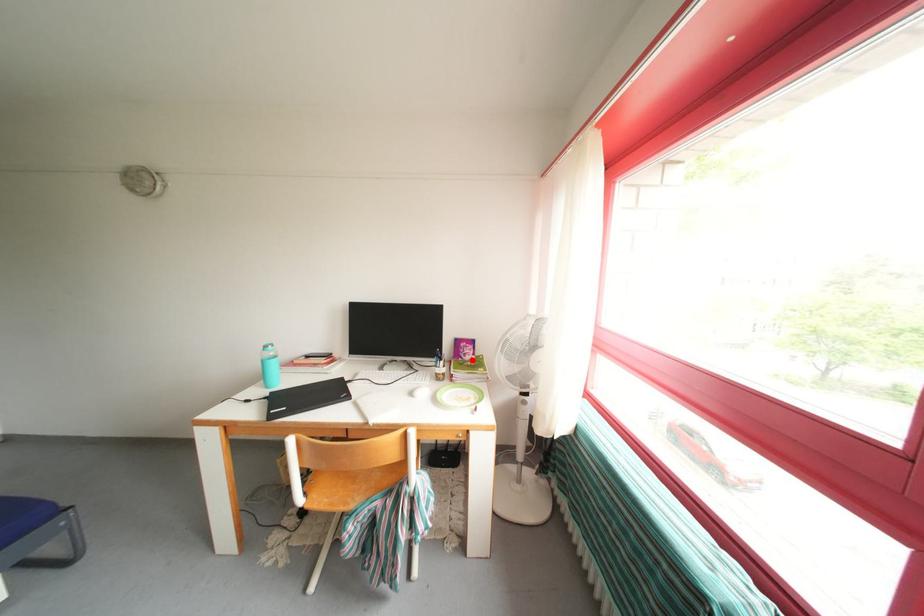
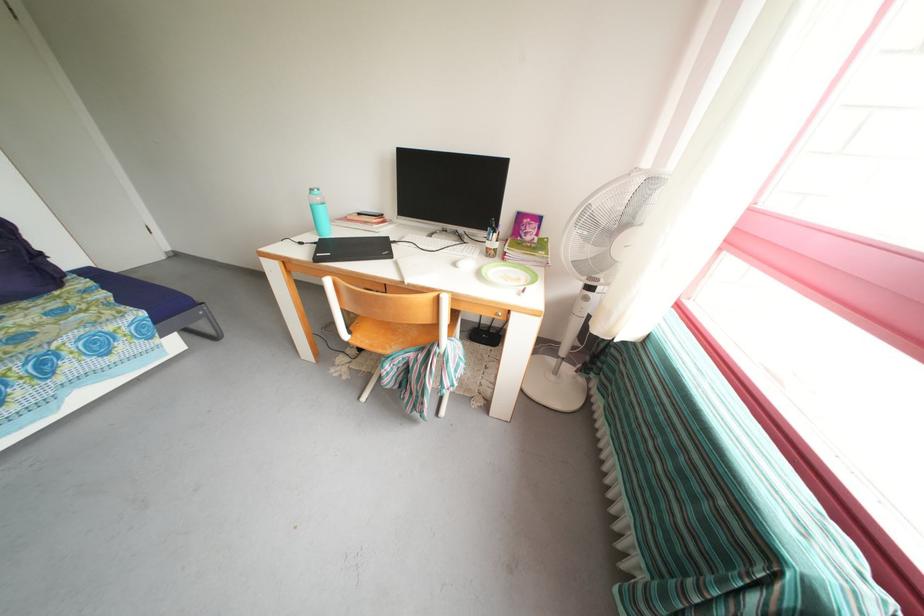
Question: A red point is marked in image1. In image2, is the corresponding 3D point closer to the camera or farther? Reply with the corresponding letter.

Choices:
 (A) The corresponding 3D point is closer.
 (B) The corresponding 3D point is farther.

Answer: (A)